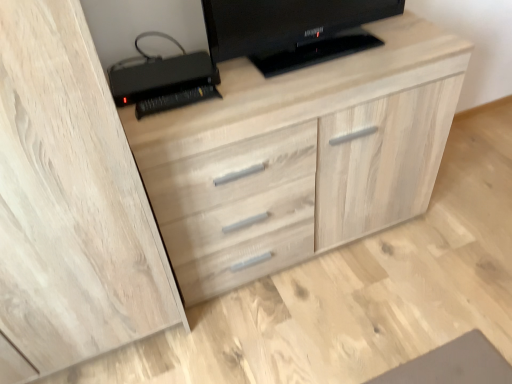
This screenshot has width=512, height=384. Identify the location of vacant region in front of black glossy television at upper center. (313, 80).